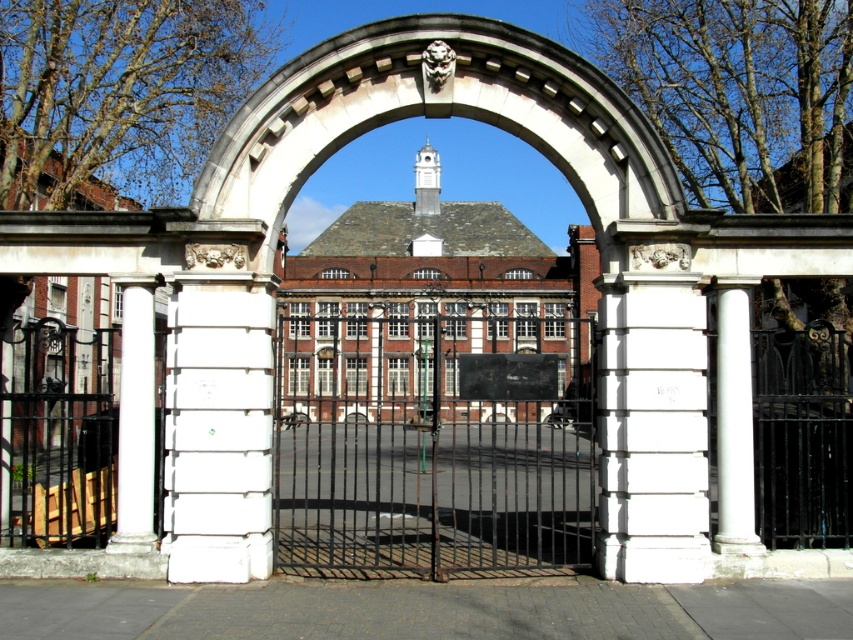
You are an architect visiting the building and want to enter through the entrance. You notice the black wrought iron gate at center and the white marble column at left. Which object is taller?

The black wrought iron gate at center is taller than the white marble column at left according to the description.

You are standing at the entrance of this grand building and want to take a photo of the white stone archway at center. If your camera has a maximum focus range of 10 meters, will you be able to capture the archway clearly?

The white stone archway at center is 11.65 meters away from the viewer. Since this distance exceeds the camera s maximum focus range of 10 meters, the archway will not be captured clearly.